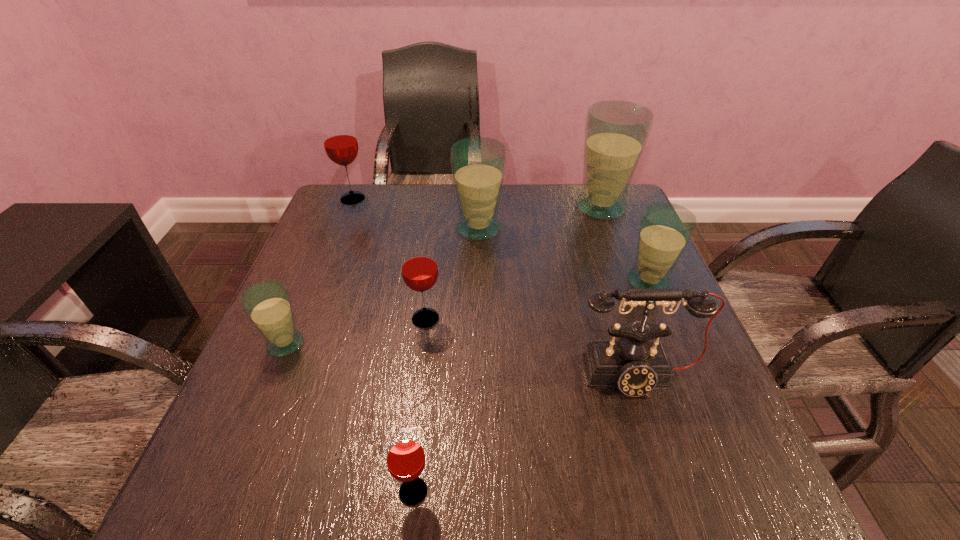
Select which object appears as the third closest to the second smallest blue glass. Please provide its 2D coordinates. Your answer should be formatted as a tuple, i.e. [(x, y)], where the tuple contains the x and y coordinates of a point satisfying the conditions above.

[(478, 164)]

Identify which glass is located as the third nearest to the biggest blue glass. Please provide its 2D coordinates. Your answer should be formatted as a tuple, i.e. [(x, y)], where the tuple contains the x and y coordinates of a point satisfying the conditions above.

[(419, 268)]

Locate which glass is the fifth closest to the biggest red glass. Please provide its 2D coordinates. Your answer should be formatted as a tuple, i.e. [(x, y)], where the tuple contains the x and y coordinates of a point satisfying the conditions above.

[(665, 229)]

I want to click on blue glass identified as the third closest to the second smallest red glass, so click(665, 229).

Identify the location of blue glass that is the second closest to the leftmost red glass. (x=267, y=304).

Where is `the second closest red glass to the black telephone`? The width and height of the screenshot is (960, 540). the second closest red glass to the black telephone is located at coordinates (405, 457).

Select which red glass appears as the third closest to the black telephone. Please provide its 2D coordinates. Your answer should be formatted as a tuple, i.e. [(x, y)], where the tuple contains the x and y coordinates of a point satisfying the conditions above.

[(340, 143)]

The image size is (960, 540). I want to click on free space that satisfies the following two spatial constraints: 1. on the back side of the second biggest blue glass; 2. on the right side of the nearest red glass, so click(442, 228).